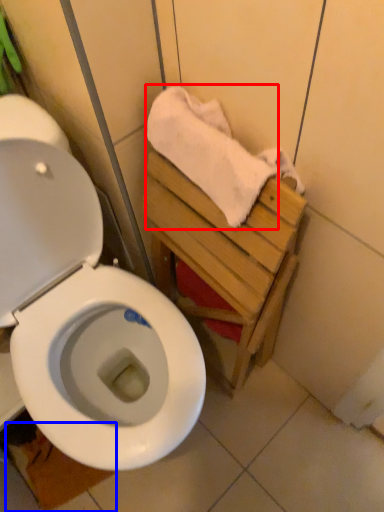
Question: Which point is closer to the camera, bath towel (highlighted by a red box) or tile (highlighted by a blue box)?

Choices:
 (A) bath towel
 (B) tile

Answer: (A)